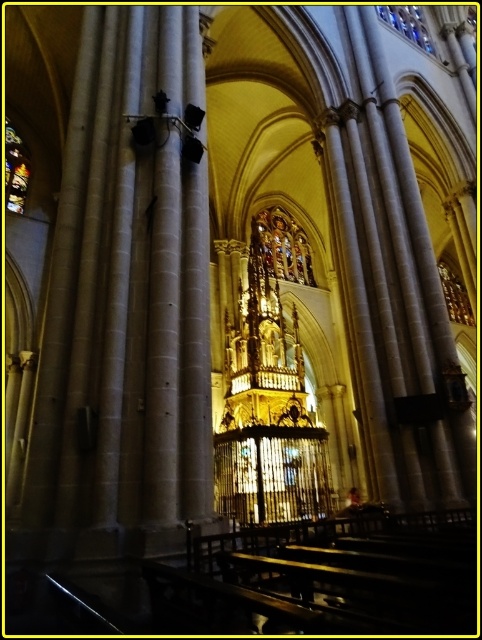
Is stained glass window at upper left positioned before stained glass window at upper center?

Yes, stained glass window at upper left is closer to the viewer.

Looking at this image, is stained glass window at upper left shorter than stained glass window at upper center?

No, stained glass window at upper left is not shorter than stained glass window at upper center.

Is point (7, 195) positioned in front of point (386, 10)?

That is True.

At what (x,y) coordinates should I click in order to perform the action: click on stained glass window at upper left. Please return your answer as a coordinate pair (x, y). Looking at the image, I should click on (14, 170).